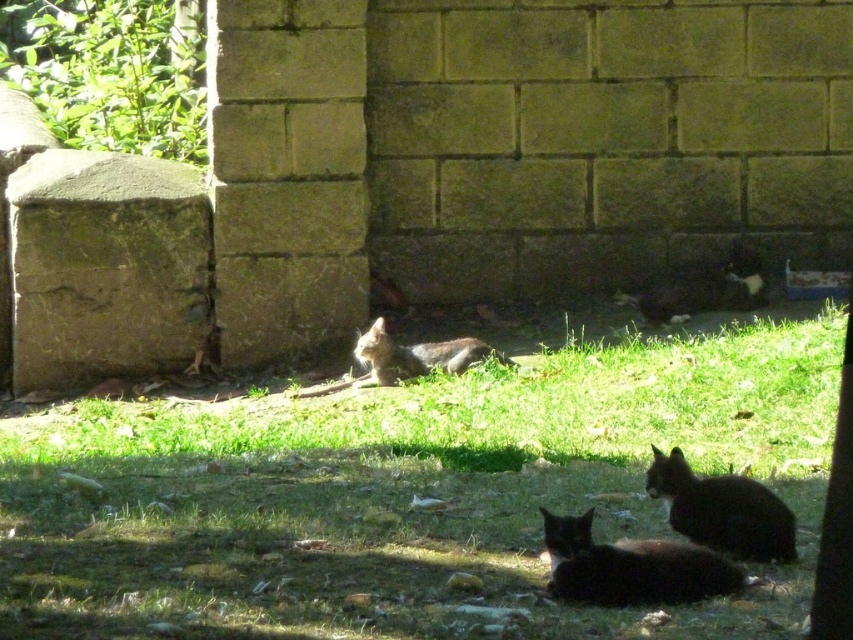
Can you confirm if green grass at center is smaller than black fur cat at lower right?

No.

Between green grass at center and black fur cat at lower right, which one is positioned higher?

green grass at center

Who is more distant from viewer, (x=347, y=637) or (x=656, y=461)?

Point (x=656, y=461)

Where is `green grass at center`? green grass at center is located at coordinates (407, 497).

I want to click on black fur cat at lower right, so click(722, 509).

Does black fur cat at lower right have a lesser width compared to fuzzy gray cat at center?

Yes, black fur cat at lower right is thinner than fuzzy gray cat at center.

Is point (791, 541) positioned after point (403, 380)?

No, it is not.

The image size is (853, 640). I want to click on black fur cat at lower right, so click(722, 509).

Is point (376, 444) closer to camera compared to point (627, 544)?

No, it is behind (627, 544).

Looking at this image, can you confirm if green grass at center is positioned to the left of black fur cat at lower center?

Indeed, green grass at center is positioned on the left side of black fur cat at lower center.

Is point (717, 420) closer to viewer compared to point (627, 540)?

No.

Where is `green grass at center`? This screenshot has width=853, height=640. green grass at center is located at coordinates (407, 497).